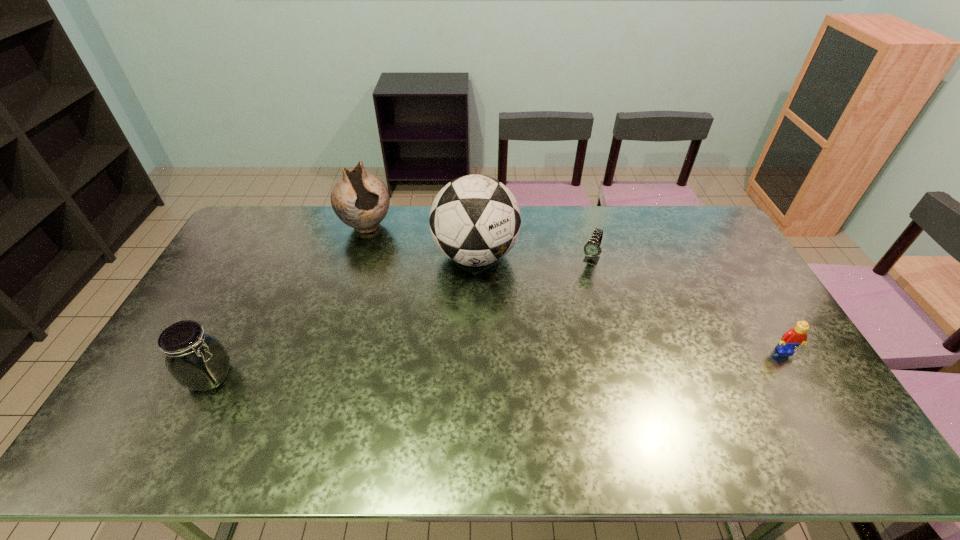
Locate an element on the screen. The height and width of the screenshot is (540, 960). jar is located at coordinates (197, 361).

Find the location of a particular element. the nearest object is located at coordinates coord(197,361).

I want to click on Lego, so [795, 336].

The width and height of the screenshot is (960, 540). Find the location of `the rightmost object`. the rightmost object is located at coordinates (795, 336).

Locate an element on the screen. Image resolution: width=960 pixels, height=540 pixels. soccer ball is located at coordinates (475, 220).

The width and height of the screenshot is (960, 540). In order to click on pottery in this screenshot , I will do `click(361, 200)`.

You are a GUI agent. You are given a task and a screenshot of the screen. Output one action in this format:
    pyautogui.click(x=<x>, y=<y>)
    Task: Click on the watch
    This screenshot has width=960, height=540.
    Given the screenshot: What is the action you would take?
    coord(592,249)

Identify the location of vacant region located on the lid of the third shortest object. This screenshot has width=960, height=540. (260, 376).

Locate an element on the screen. free location located on the front-facing side of the Lego is located at coordinates (825, 417).

You are a GUI agent. You are given a task and a screenshot of the screen. Output one action in this format:
    pyautogui.click(x=<x>, y=<y>)
    Task: Click on the blank space located 0.300m on the surface of the third object from left to right where the brand logo is visible
    The image size is (960, 540).
    Given the screenshot: What is the action you would take?
    pyautogui.click(x=473, y=361)